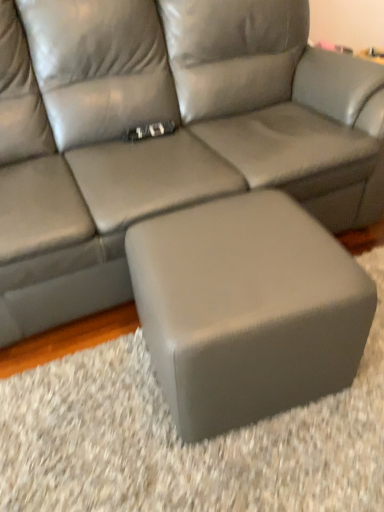
Find the location of a particular element. The height and width of the screenshot is (512, 384). vacant region to the left of matte gray ottoman at center is located at coordinates (85, 410).